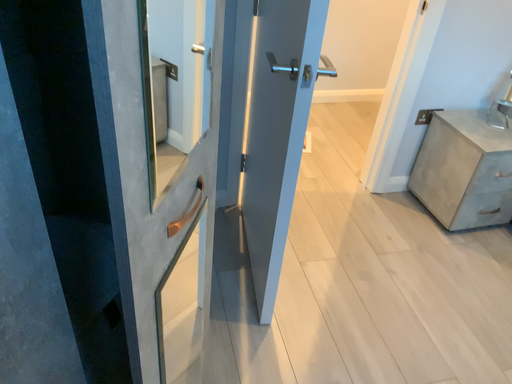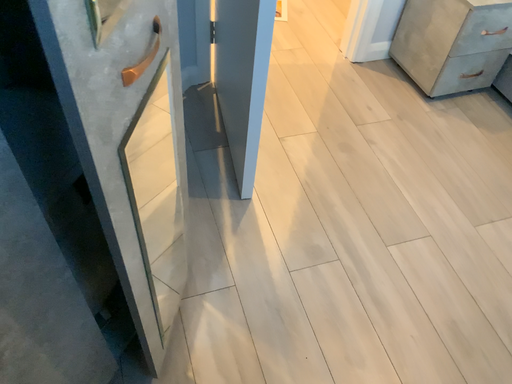
Question: How did the camera likely rotate when shooting the video?

Choices:
 (A) rotated downward
 (B) rotated upward

Answer: (A)